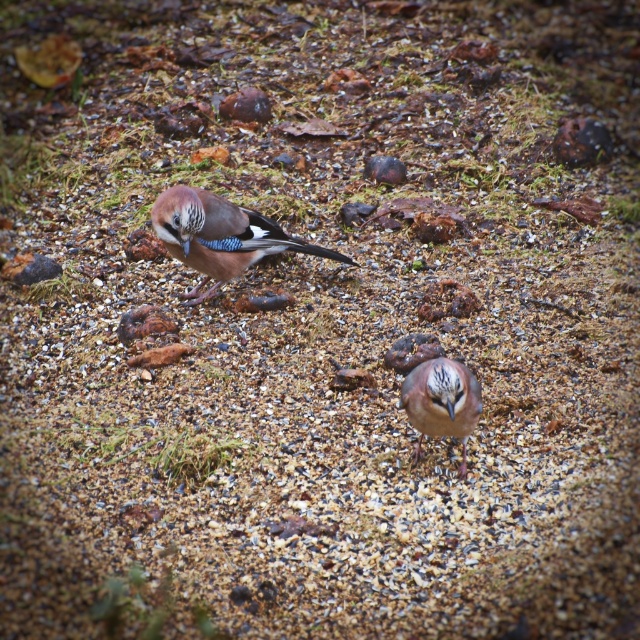
Question: Is brown speckled feathers at center above smooth brown rock at center?

Choices:
 (A) yes
 (B) no

Answer: (B)

Question: Considering the real-world distances, which object is closest to the brown speckled feathers at center?

Choices:
 (A) matte brown bird at center
 (B) smooth brown rock at center

Answer: (A)

Question: Among these points, which one is farthest from the camera?

Choices:
 (A) (221, 109)
 (B) (156, 228)
 (C) (452, 429)

Answer: (A)

Question: Which point appears farthest from the camera in this image?

Choices:
 (A) (237, 106)
 (B) (230, 234)
 (C) (419, 403)

Answer: (A)

Question: Is the position of matte brown bird at center more distant than that of brown speckled feathers at center?

Choices:
 (A) yes
 (B) no

Answer: (A)

Question: Is matte brown bird at center positioned behind smooth brown rock at center?

Choices:
 (A) no
 (B) yes

Answer: (A)